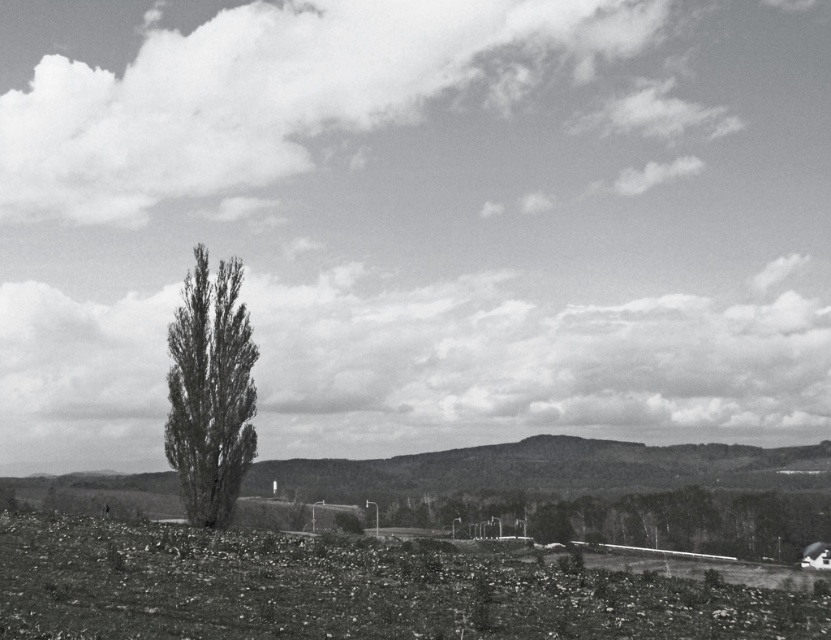
You are standing at the edge of the road and want to walk towards the smooth green tree at center. Which direction should you move relative to the gravelly soil at lower center?

You should move away from the gravelly soil at lower center because the smooth green tree at center is further away from the viewer than the gravelly soil at lower center.

You are a hiker who wants to take a photo of both the smooth green tree at center and the gray textured tree at center. Since you have a camera with a fixed focal length, you need to stand at a position where both trees are fully visible in the frame. Which tree should you position closer to the camera to ensure both are in the shot?

To ensure both the smooth green tree at center and the gray textured tree at center are fully visible in the frame, you should position the smaller gray textured tree at center closer to the camera. Since the smooth green tree at center is larger, placing the smaller one nearer will help balance their apparent sizes in the photo.

You are a gardener planning to plant a new tree in the gravelly soil at lower center. Considering the position of the smooth green tree at center, which is already present, can you determine if the new tree will be planted above or below the existing tree?

The gravelly soil at lower center is above the smooth green tree at center, so planting the new tree in the gravelly soil at lower center would place it above the existing tree.